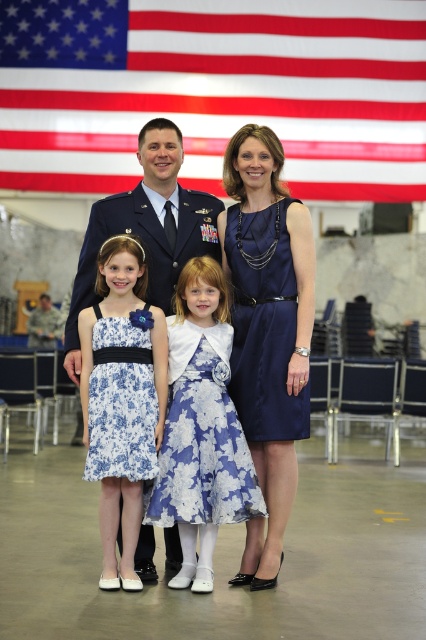
You are a photographer adjusting the lighting for a family portrait. You notice two main focal points in the image, the floral satin dress at center and the blue satin uniform at center. Which of these two items requires a wider lighting setup to accommodate its size?

The blue satin uniform at center is larger than the floral satin dress at center, so it requires a wider lighting setup to accommodate its size.